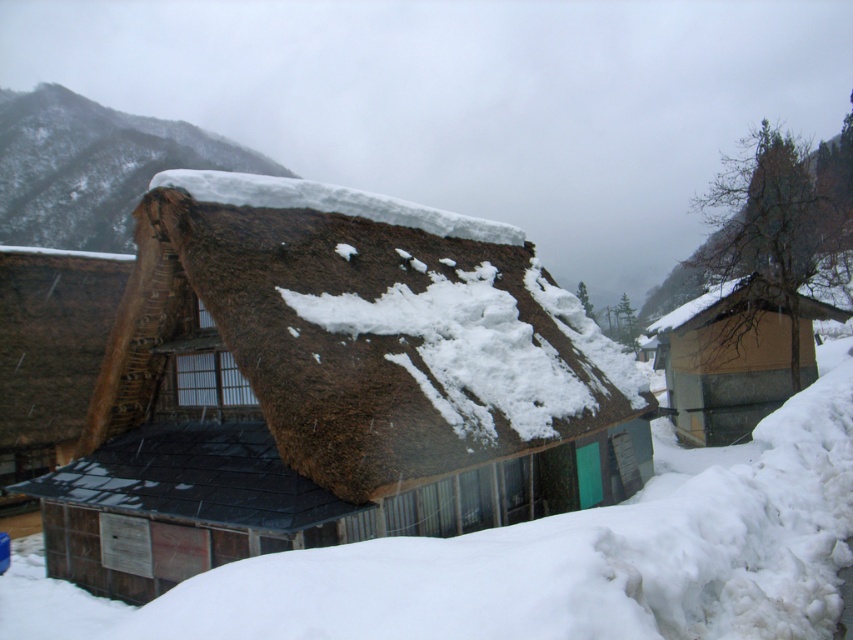
You are standing in the snowy landscape and see the brown thatch hut at center and the brown thatch at upper left. Which one is located higher up in the image?

The brown thatch at upper left is higher up in the image because the brown thatch hut at center is positioned under it.

Based on the photo, you are standing in front of the snowy thatched house and notice two elements in the upper part of the image. Which one is positioned higher up between the brown thatch at upper left and the bare tree at upper right?

The brown thatch at upper left is positioned higher up than the bare tree at upper right.